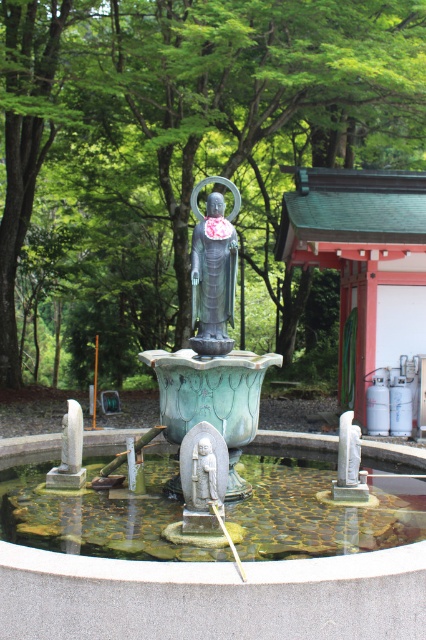
You are standing in the garden and want to place a small plant between the green patina stone fountain at center and the clear stone water at center. Based on their positions, which side of the fountain should you place the plant so it is closer to the water?

The green patina stone fountain at center is to the left of clear stone water at center, so placing the plant to the right side of the fountain would position it closer to the water.

You are standing in the outdoor setting described. There is a point marked at coordinates (227, 486). What does this point represent?

The point at (227, 486) represents the green patina stone fountain at center.

You are a photographer planning to take a picture of the green leafy tree at upper center and the polished bronze statue at center. Based on their sizes, which one should you focus on to ensure it appears more prominent in the photo?

The green leafy tree at upper center is larger in size than the polished bronze statue at center, so focusing on it will make it appear more prominent in the photo.